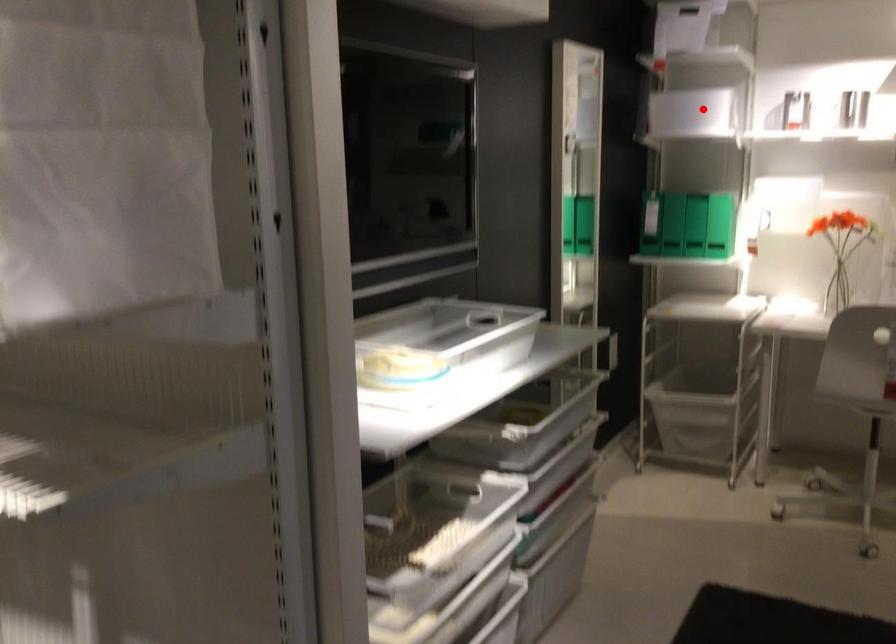
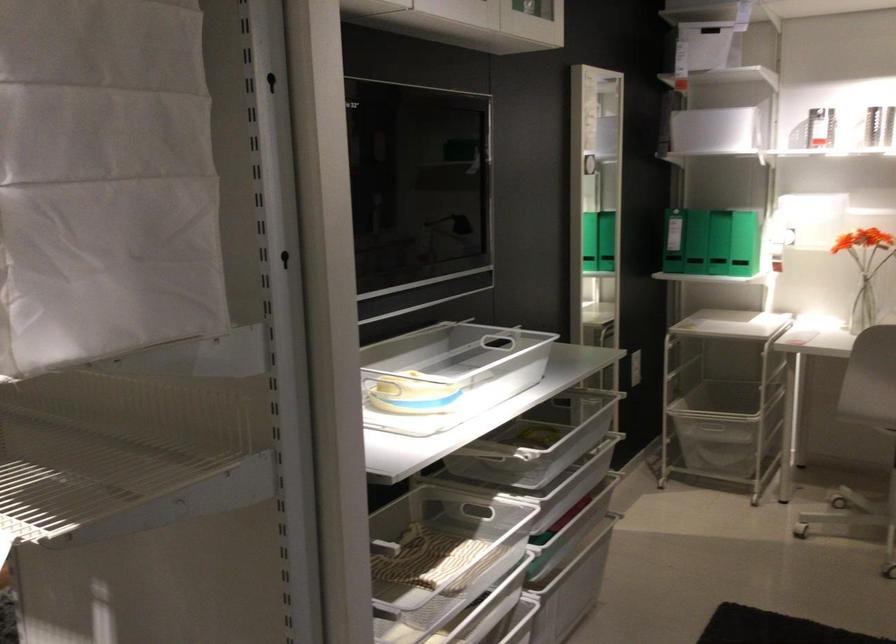
In the second image, find the point that corresponds to the highlighted location in the first image.

(716, 133)